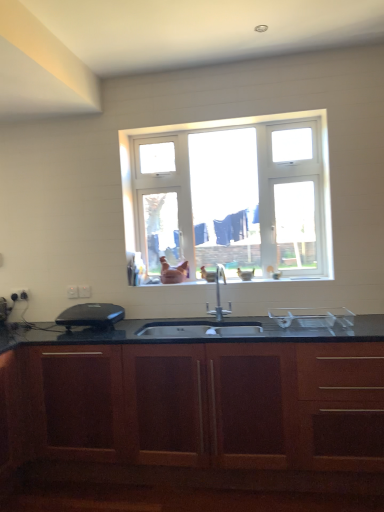
Question: In terms of size, does black plastic appliance at left appear bigger or smaller than wooden cabinet at center?

Choices:
 (A) big
 (B) small

Answer: (B)

Question: Is black plastic appliance at left spatially inside wooden cabinet at center, or outside of it?

Choices:
 (A) outside
 (B) inside

Answer: (A)

Question: Which is nearer to the black plastic appliance at left?

Choices:
 (A) white plastic electric outlet at lower left, the 2th electric outlet when ordered from front to back
 (B) satin nickel faucet at center
 (C) wooden cabinet at center
 (D) white plastic window at center
 (E) white plastic electric outlet at lower left, which is counted as the third electric outlet, starting from the right

Answer: (A)

Question: Which object is the closest to the white glossy sink at center?

Choices:
 (A) white plastic window at center
 (B) white plastic electric outlet at lower left, the second electric outlet viewed from the right
 (C) white plastic electric outlet at lower left, which is counted as the third electric outlet, starting from the right
 (D) satin nickel faucet at center
 (E) white plastic electric outlet at lower left, the 3th electric outlet from the back

Answer: (D)